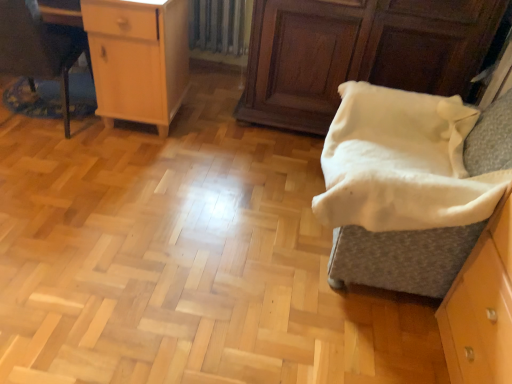
This screenshot has width=512, height=384. Find the location of `vacant space in between light wood cabinet at upper left and brushed metal desk at left`. vacant space in between light wood cabinet at upper left and brushed metal desk at left is located at coordinates (104, 139).